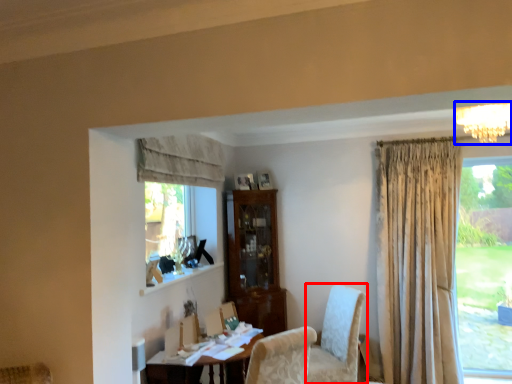
Question: Which point is closer to the camera, chair (highlighted by a red box) or light fixture (highlighted by a blue box)?

Choices:
 (A) chair
 (B) light fixture

Answer: (B)